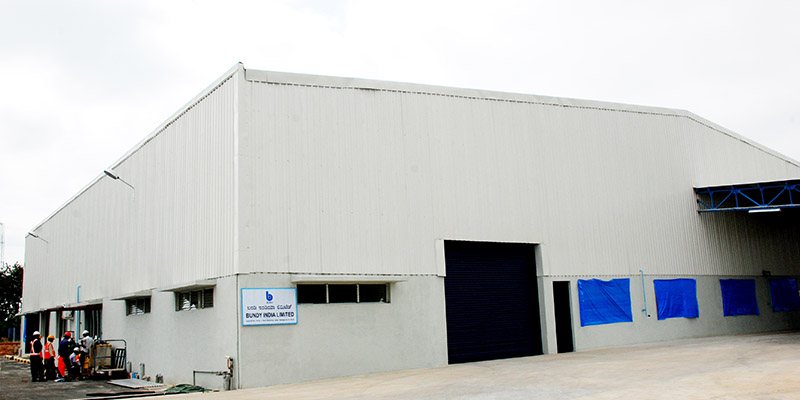
Find the location of a particular element. Image resolution: width=800 pixels, height=400 pixels. small set of 3 windows by sign is located at coordinates (313, 290), (346, 295), (377, 295).